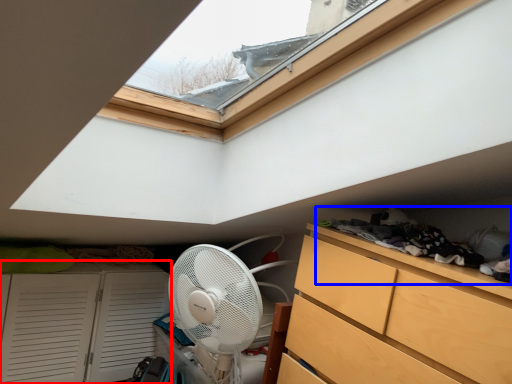
Question: Which object is closer to the camera taking this photo, cupboard (highlighted by a red box) or laundry (highlighted by a blue box)?

Choices:
 (A) cupboard
 (B) laundry

Answer: (B)